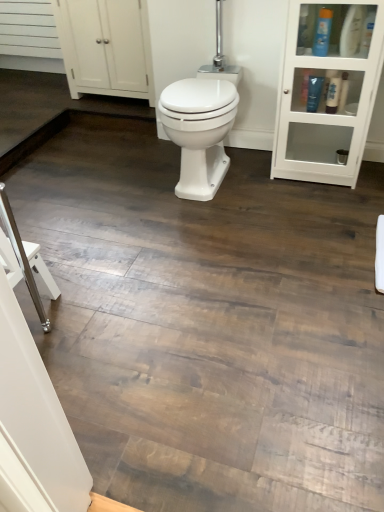
Question: From a real-world perspective, is blue plastic bottle at upper right, which appears as the third toiletry when viewed from the left, located beneath white matte cabinet at upper left?

Choices:
 (A) yes
 (B) no

Answer: (B)

Question: Does blue plastic bottle at upper right, arranged as the 1th toiletry when viewed from the right, come in front of white matte cabinet at upper left?

Choices:
 (A) no
 (B) yes

Answer: (B)

Question: From the image's perspective, does blue plastic bottle at upper right, arranged as the 1th toiletry when viewed from the right, appear lower than white matte cabinet at upper left?

Choices:
 (A) yes
 (B) no

Answer: (A)

Question: Could you tell me if blue plastic bottle at upper right, arranged as the 1th toiletry when viewed from the right, is facing white matte cabinet at upper left?

Choices:
 (A) no
 (B) yes

Answer: (A)

Question: Does blue plastic bottle at upper right, arranged as the 1th toiletry when viewed from the right, touch white matte cabinet at upper left?

Choices:
 (A) yes
 (B) no

Answer: (B)

Question: Does point (352, 35) appear closer or farther from the camera than point (165, 119)?

Choices:
 (A) farther
 (B) closer

Answer: (A)

Question: Based on their sizes in the image, would you say blue plastic bottle at upper right, which appears as the third toiletry when viewed from the left, is bigger or smaller than white glossy bidet at center?

Choices:
 (A) big
 (B) small

Answer: (B)

Question: In terms of width, does blue plastic bottle at upper right, arranged as the 1th toiletry when viewed from the right, look wider or thinner when compared to white glossy bidet at center?

Choices:
 (A) wide
 (B) thin

Answer: (B)

Question: Is blue plastic bottle at upper right, which appears as the third toiletry when viewed from the left, in front of or behind white glossy bidet at center in the image?

Choices:
 (A) behind
 (B) front

Answer: (B)

Question: Is white matte cabinet at upper left to the left or to the right of blue plastic bottle at upper right, which is counted as the second toiletry, starting from the right, in the image?

Choices:
 (A) right
 (B) left

Answer: (B)

Question: From the image's perspective, relative to blue plastic bottle at upper right, which is counted as the second toiletry, starting from the right, is white matte cabinet at upper left above or below?

Choices:
 (A) above
 (B) below

Answer: (A)

Question: From a real-world perspective, relative to blue plastic bottle at upper right, which is counted as the second toiletry, starting from the right, is white matte cabinet at upper left vertically above or below?

Choices:
 (A) below
 (B) above

Answer: (A)

Question: Considering the positions of point (94, 71) and point (321, 45), is point (94, 71) closer or farther from the camera than point (321, 45)?

Choices:
 (A) closer
 (B) farther

Answer: (B)

Question: Do you think blue plastic bottle at upper right, the second toiletry when ordered from left to right, is within shiny black tube at upper right, placed as the 1th toiletry when sorted from left to right, or outside of it?

Choices:
 (A) outside
 (B) inside

Answer: (A)

Question: In terms of width, does blue plastic bottle at upper right, which is counted as the second toiletry, starting from the right, look wider or thinner when compared to shiny black tube at upper right, arranged as the third toiletry when viewed from the right?

Choices:
 (A) thin
 (B) wide

Answer: (B)